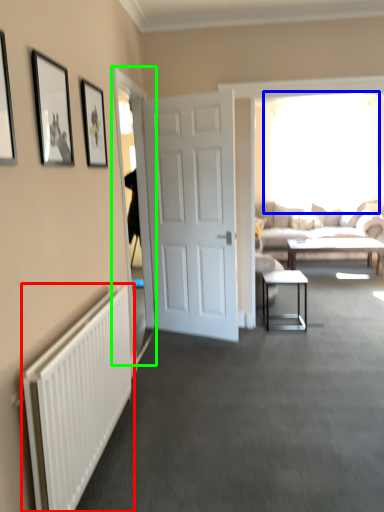
Question: Based on their relative distances, which object is farther from radiator (highlighted by a red box)? Choose from window (highlighted by a blue box) and glass door (highlighted by a green box).

Choices:
 (A) window
 (B) glass door

Answer: (A)